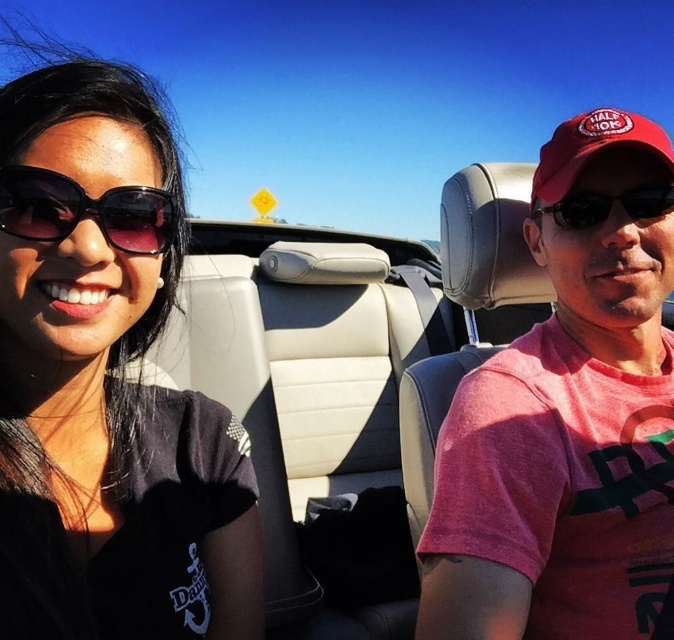
Does point (661, 145) lie in front of point (586, 196)?

Yes, point (661, 145) is in front of point (586, 196).

The height and width of the screenshot is (640, 674). What are the coordinates of `red fabric baseball cap at upper right` in the screenshot? It's located at (592, 147).

You are a GUI agent. You are given a task and a screenshot of the screen. Output one action in this format:
    pyautogui.click(x=<x>, y=<y>)
    Task: Click on the red fabric baseball cap at upper right
    
    Given the screenshot: What is the action you would take?
    pyautogui.click(x=592, y=147)

Which is behind, point (520, 602) or point (605, 136)?

The point (605, 136) is behind.

This screenshot has width=674, height=640. What do you see at coordinates (568, 416) in the screenshot?
I see `pink cotton shirt at center` at bounding box center [568, 416].

Which is in front, point (582, 570) or point (638, 134)?

Positioned in front is point (582, 570).

Find the location of a particular element. This screenshot has height=640, width=674. pink cotton shirt at center is located at coordinates (568, 416).

Is black matte sunglasses at upper left smaller than pink cotton shirt at center?

Yes, black matte sunglasses at upper left is smaller than pink cotton shirt at center.

Is black matte sunglasses at upper left positioned behind pink cotton shirt at center?

That is False.

Who is more distant from viewer, (x=55, y=195) or (x=673, y=442)?

Positioned behind is point (x=673, y=442).

Locate an element on the screen. Image resolution: width=674 pixels, height=640 pixels. black matte sunglasses at upper left is located at coordinates (106, 381).